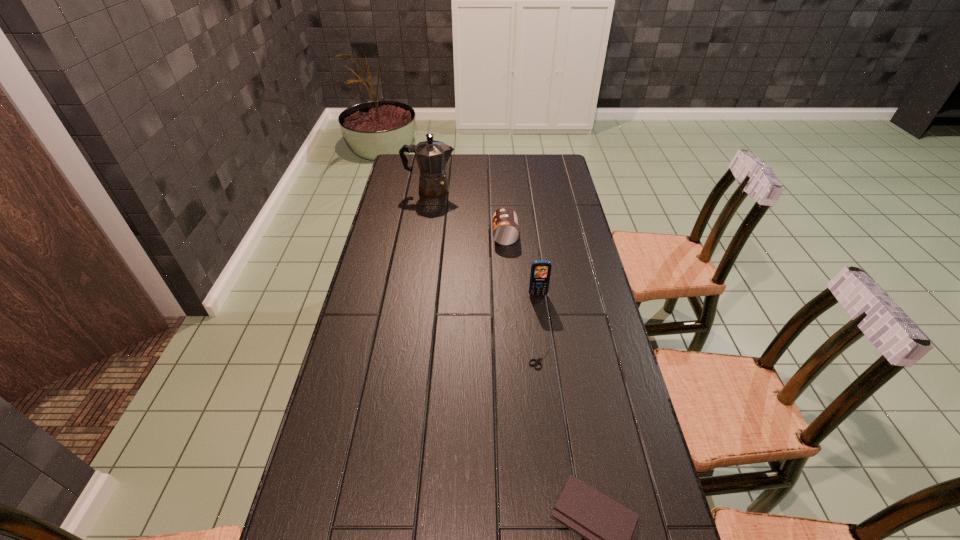
Where is `the leftmost object`? the leftmost object is located at coordinates pos(431,156).

I want to click on coffeepot, so click(x=431, y=156).

Locate an element on the screen. The height and width of the screenshot is (540, 960). the fourth shortest object is located at coordinates (540, 272).

Where is `the third nearest object`? the third nearest object is located at coordinates pyautogui.click(x=540, y=272).

Find the location of a particular element. can is located at coordinates (505, 224).

The width and height of the screenshot is (960, 540). Identify the location of the second farthest object. (505, 224).

The width and height of the screenshot is (960, 540). Identify the location of the shortest object. (537, 361).

This screenshot has width=960, height=540. I want to click on the fourth farthest object, so click(537, 361).

Identify the location of blank space located on the pouring side of the farthest object. (480, 190).

You are a GUI agent. You are given a task and a screenshot of the screen. Output one action in this format:
    pyautogui.click(x=<x>, y=<y>)
    Task: Click on the vacant area situated 0.390m on the screen of the second tallest object
    This screenshot has width=960, height=540.
    Given the screenshot: What is the action you would take?
    pyautogui.click(x=553, y=405)